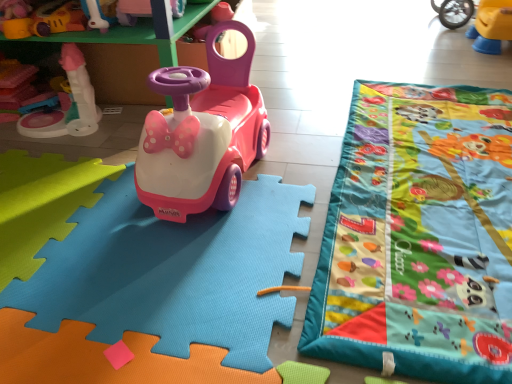
Find the location of a particular element. free space below multicolored fabric play mat at right (from a real-world perspective) is located at coordinates (442, 138).